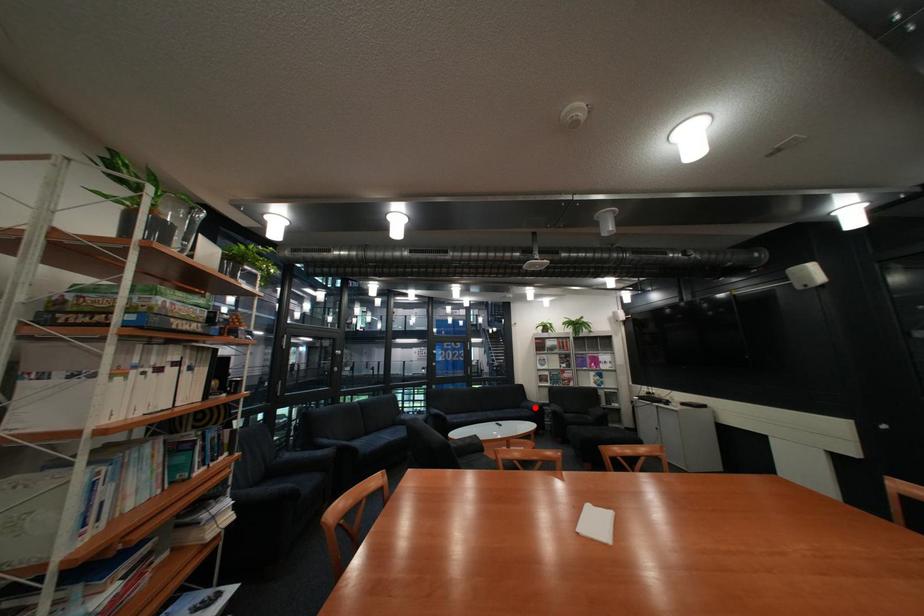
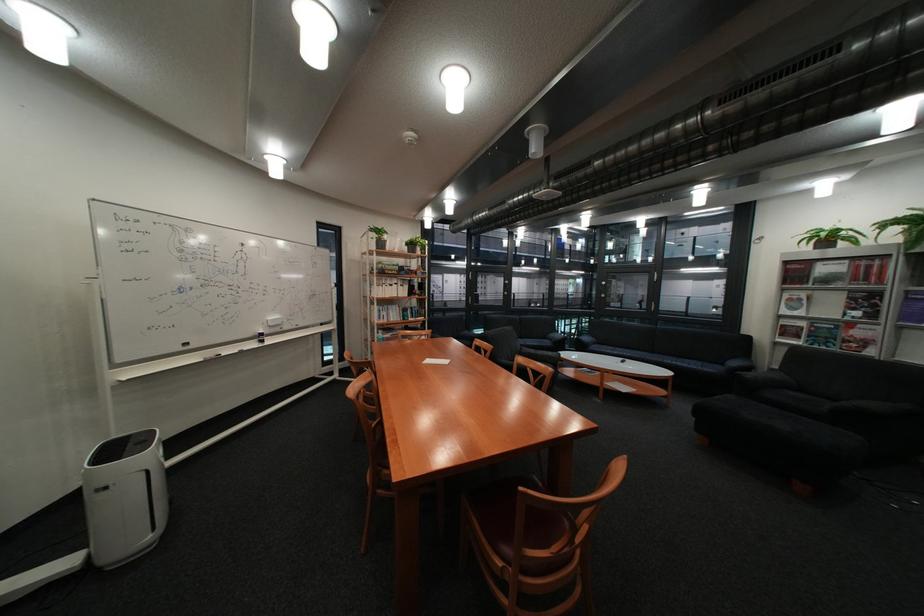
The point at the highlighted location is marked in the first image. Where is the corresponding point in the second image?

(737, 363)